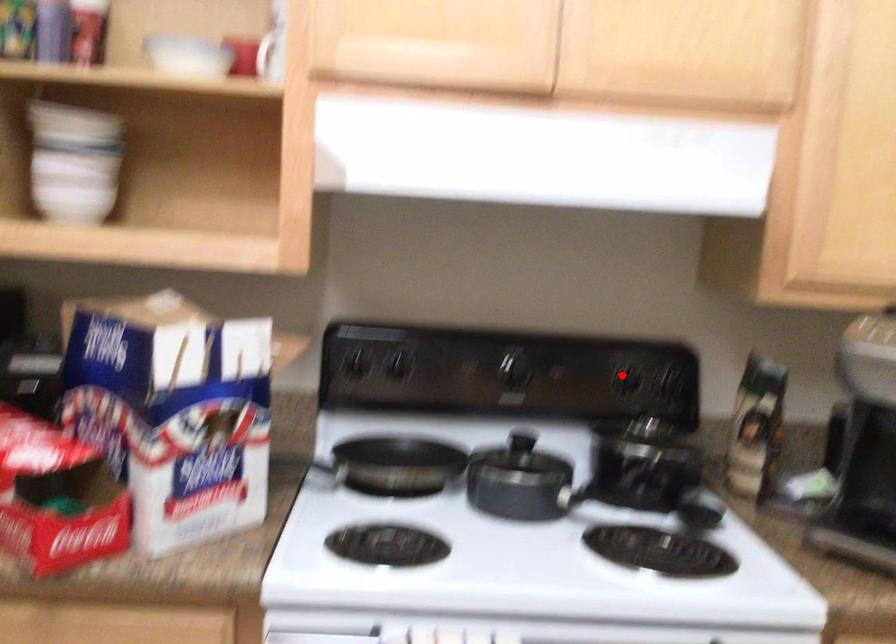
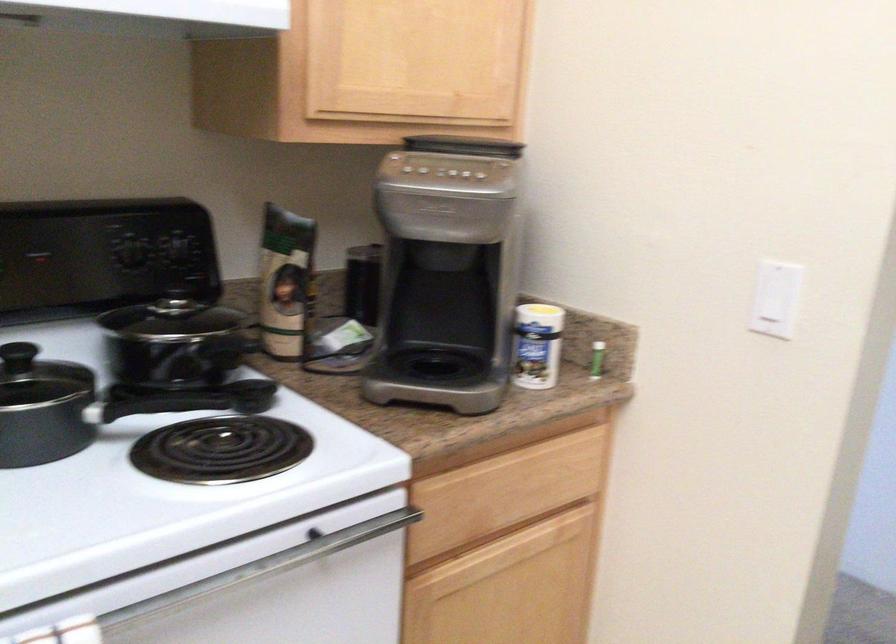
Where in the second image is the point corresponding to the highlighted location from the first image?

(130, 247)